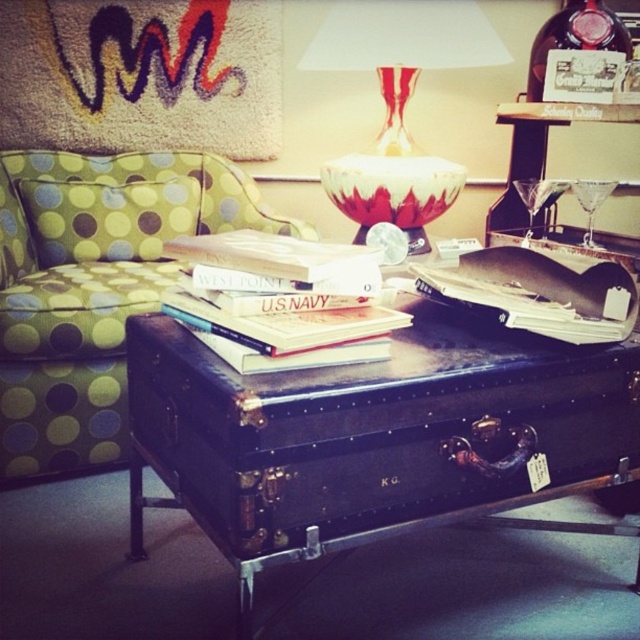
You are a delivery person who needs to place a 12 inch wide package between the black leather suitcase at center and the green armchair with bold polka dots on the left. Can the package fit in the space between them?

The space between the black leather suitcase at center and the green armchair with bold polka dots on the left is 29.79 inches. Since the package is 12 inches wide, it can fit comfortably in the space between them.

You are standing in the middle of the room and want to place a new decorative item exactly where the black leather suitcase at center is currently located. What are the coordinates where you should place it?

The coordinates for placing the decorative item should be at point (372, 435), which is where the black leather suitcase at center is located.